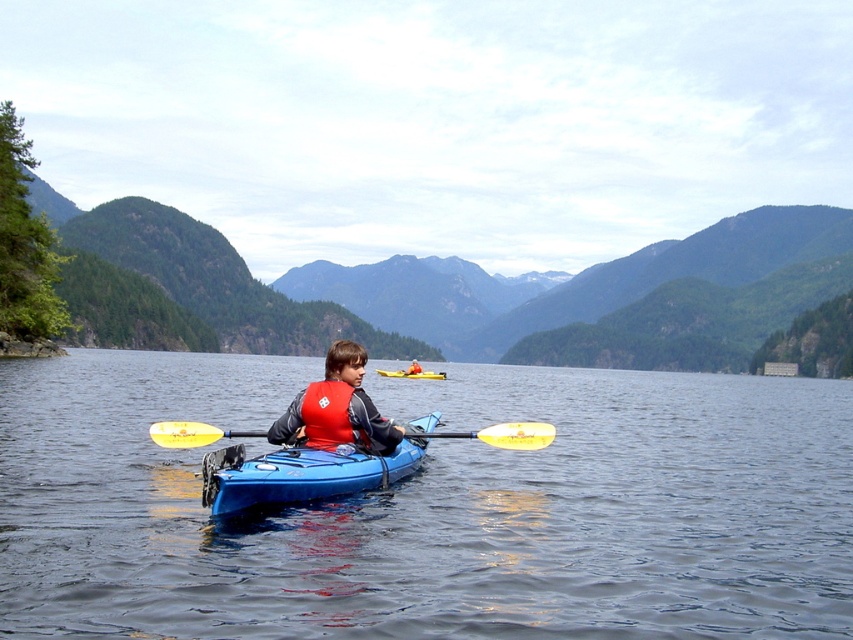
Question: Which object is the closest to the yellow plastic kayak at center?

Choices:
 (A) orange matte life jacket at center
 (B) red life vest at center
 (C) yellow foam paddle at center

Answer: (C)

Question: Which object is the farthest from the yellow plastic kayak at center?

Choices:
 (A) blue plastic kayak at center
 (B) yellow foam paddle at center

Answer: (A)

Question: Does blue glossy water at center have a smaller size compared to yellow plastic kayak at center?

Choices:
 (A) yes
 (B) no

Answer: (B)

Question: Does red life vest at center appear over yellow foam paddle at center?

Choices:
 (A) yes
 (B) no

Answer: (A)

Question: Which object is the farthest from the blue glossy water at center?

Choices:
 (A) red life vest at center
 (B) yellow foam paddle at center

Answer: (B)

Question: Is yellow foam paddle at center to the right of orange matte life jacket at center from the viewer's perspective?

Choices:
 (A) no
 (B) yes

Answer: (B)